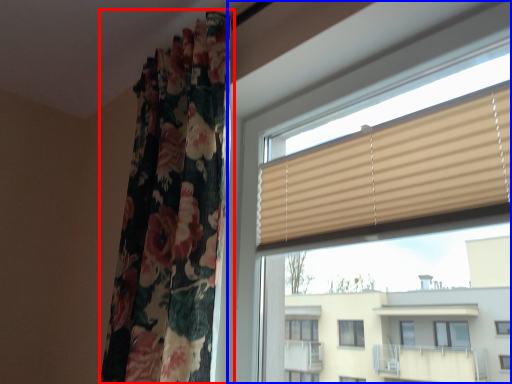
Question: Which object is further to the camera taking this photo, curtain (highlighted by a red box) or window (highlighted by a blue box)?

Choices:
 (A) curtain
 (B) window

Answer: (A)